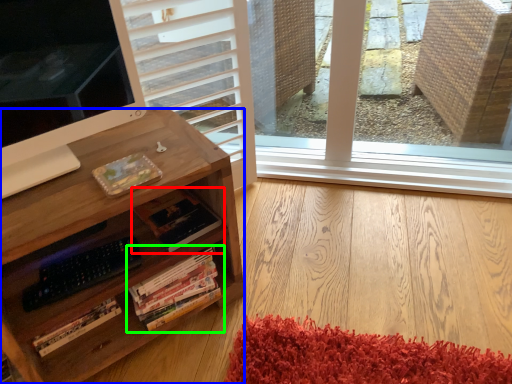
Question: Which is farther away from book (highlighted by a red box)? desk (highlighted by a blue box) or book (highlighted by a green box)?

Choices:
 (A) desk
 (B) book

Answer: (A)